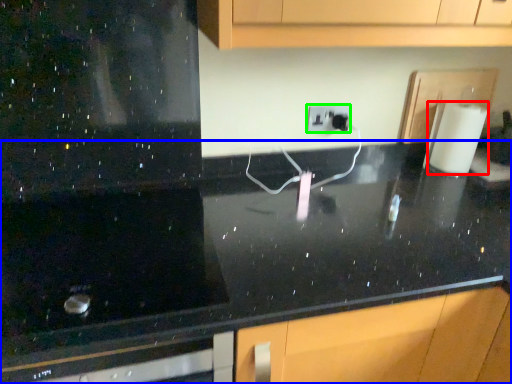
Question: Considering the real-world distances, which object is farthest from paper towel (highlighted by a red box)? countertop (highlighted by a blue box) or electric outlet (highlighted by a green box)?

Choices:
 (A) countertop
 (B) electric outlet

Answer: (A)